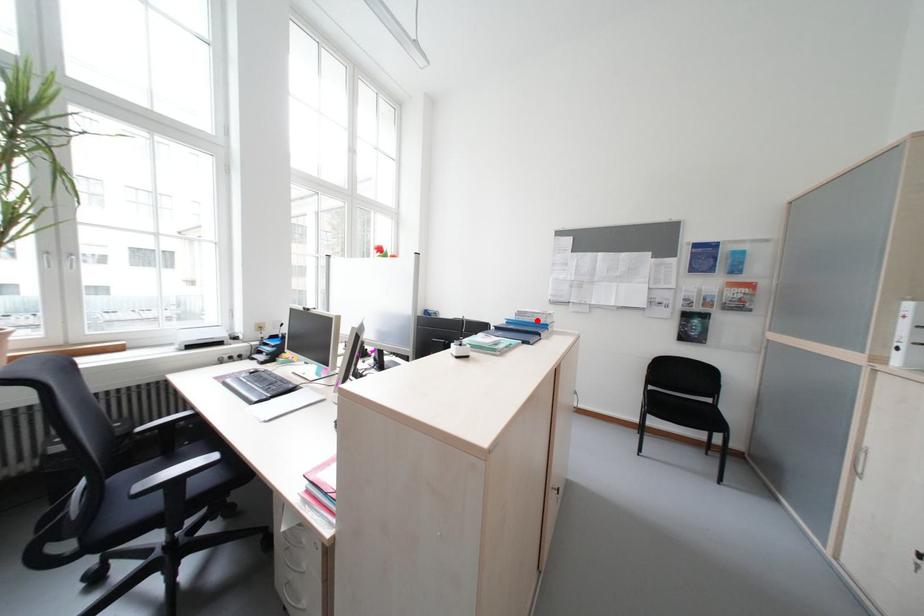
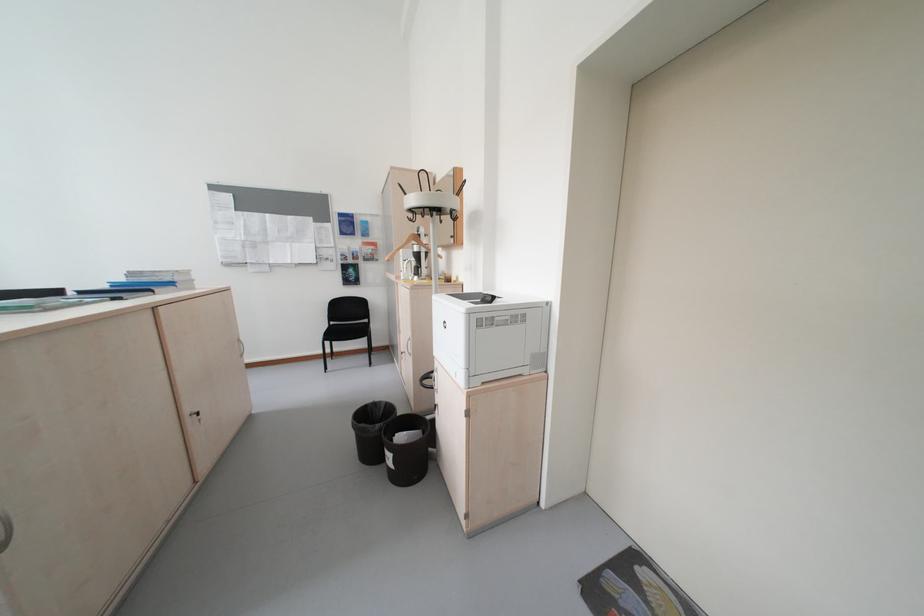
Locate, in the second image, the point that corresponds to the highlighted location in the first image.

(155, 281)